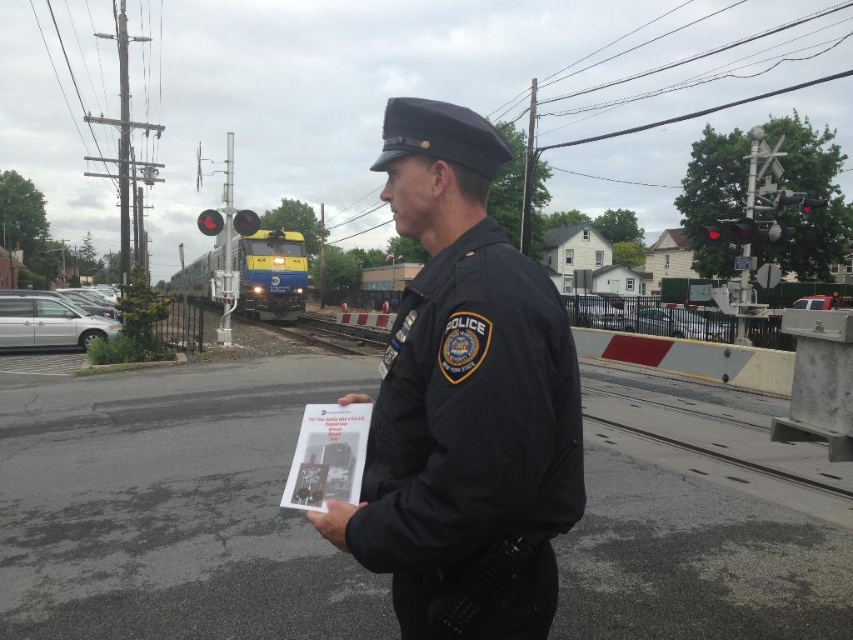
Question: Where is black fabric police uniform at center located in relation to smooth concrete train track at center in the image?

Choices:
 (A) above
 (B) below

Answer: (B)

Question: Which object appears closest to the camera in this image?

Choices:
 (A) white paper at center
 (B) smooth concrete train track at center
 (C) black fabric police uniform at center

Answer: (C)

Question: Can you confirm if black fabric police uniform at center is smaller than white paper at center?

Choices:
 (A) no
 (B) yes

Answer: (A)

Question: Which point is farther to the camera?

Choices:
 (A) white paper at center
 (B) smooth concrete train track at center

Answer: (B)

Question: Can you confirm if smooth concrete train track at center is positioned above white paper at center?

Choices:
 (A) yes
 (B) no

Answer: (A)

Question: Which of these objects is positioned closest to the smooth concrete train track at center?

Choices:
 (A) black fabric police uniform at center
 (B) white paper at center

Answer: (B)